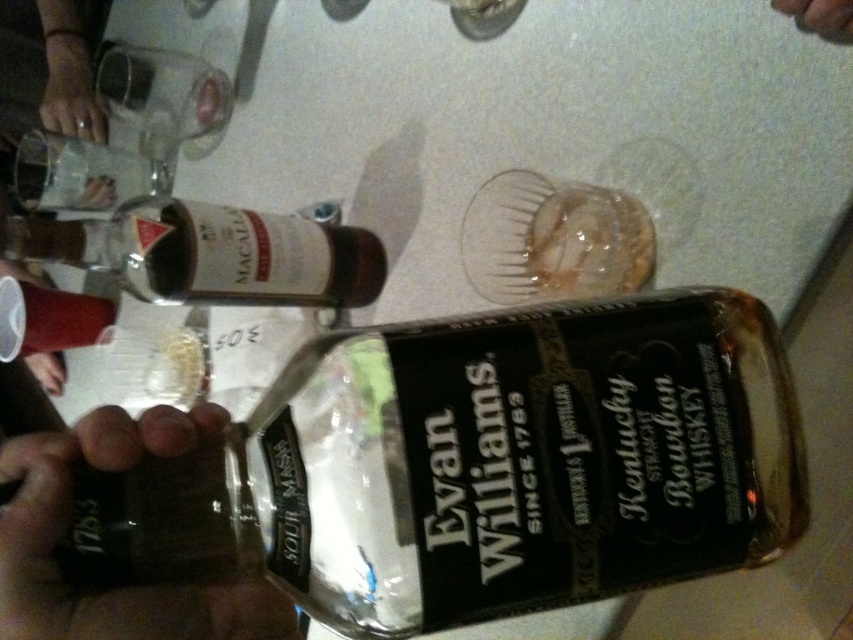
Where is `matte glass bottle at upper left`? matte glass bottle at upper left is located at coordinates (210, 253).

Does point (375, 272) come in front of point (74, 305)?

That is True.

Is point (142, 248) more distant than point (51, 305)?

No, it is in front of (51, 305).

Identify the location of matte glass bottle at upper left. Image resolution: width=853 pixels, height=640 pixels. (210, 253).

Identify the location of translucent plastic cup at lower left. The image size is (853, 640). (49, 320).

Does translucent plastic cup at lower left appear on the left side of matte plastic cup at lower left?

Incorrect, translucent plastic cup at lower left is not on the left side of matte plastic cup at lower left.

Where is `translucent plastic cup at lower left`? Image resolution: width=853 pixels, height=640 pixels. translucent plastic cup at lower left is located at coordinates (49, 320).

Is clear glass bottle at upper left closer to camera compared to translucent plastic cup at lower left?

No, it is behind translucent plastic cup at lower left.

Is point (100, 198) positioned before point (84, 340)?

Yes, point (100, 198) is in front of point (84, 340).

The height and width of the screenshot is (640, 853). I want to click on clear glass bottle at upper left, so click(78, 173).